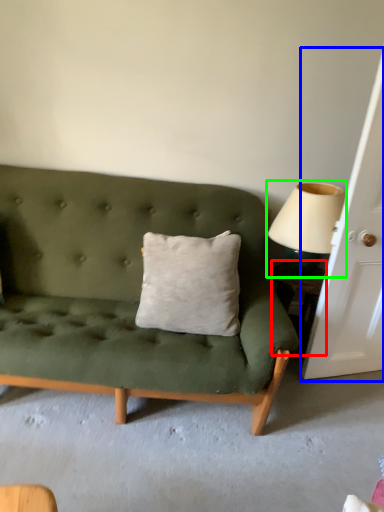
Question: Which object is the closest to the table (highlighted by a red box)? Choose among these: door (highlighted by a blue box) or table lamp (highlighted by a green box).

Choices:
 (A) door
 (B) table lamp

Answer: (B)